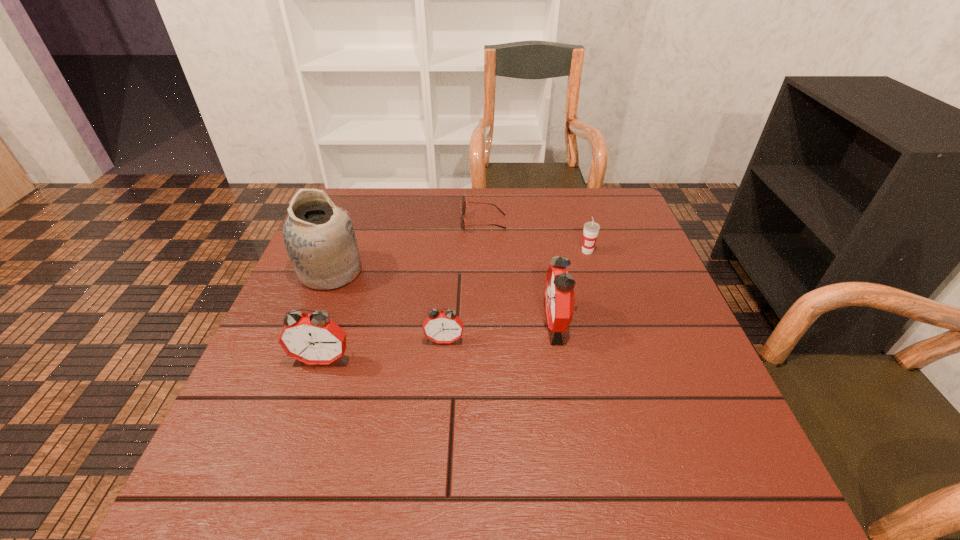
Locate an element on the screen. The height and width of the screenshot is (540, 960). the nearest object is located at coordinates (314, 338).

Where is `the third tallest object`? This screenshot has width=960, height=540. the third tallest object is located at coordinates (314, 338).

Where is `the shortest alarm clock`? The width and height of the screenshot is (960, 540). the shortest alarm clock is located at coordinates (445, 326).

Locate an element on the screen. the second object from right to left is located at coordinates 559,290.

Find the location of a particular element. sunglasses is located at coordinates (463, 208).

Where is `the farthest object`? the farthest object is located at coordinates (463, 208).

Image resolution: width=960 pixels, height=540 pixels. In order to click on pottery in this screenshot , I will do `click(319, 237)`.

You are a GUI agent. You are given a task and a screenshot of the screen. Output one action in this format:
    pyautogui.click(x=<x>, y=<y>)
    Task: Click on the rightmost object
    The width and height of the screenshot is (960, 540).
    Given the screenshot: What is the action you would take?
    pyautogui.click(x=591, y=229)

Image resolution: width=960 pixels, height=540 pixels. I want to click on vacant space located on the clock face of the nearest alarm clock, so click(x=310, y=396).

The image size is (960, 540). Identify the location of blank space located on the clock face of the second alarm clock from right to left. (439, 409).